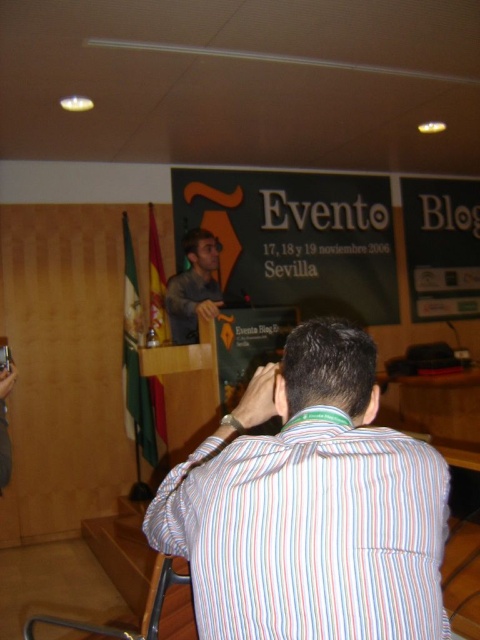
You are standing in the room where the presentation is happening. You notice two points marked in the image. The first point is at coordinates point (251, 573) and the second point is at point (208, 275). If you were to walk towards both points from your current position, which point would you reach first?

You would reach point (251, 573) first because it is closer to you than point (208, 275).

What is located at the coordinates point [310,532]?

The striped cotton shirt at back is located at point [310,532].

You are attending an event and notice two shirts in the background. The striped cotton shirt at back and the dark gray fabric shirt at center. Which shirt is closer to you?

The striped cotton shirt at back is closer to the viewer than the dark gray fabric shirt at center.